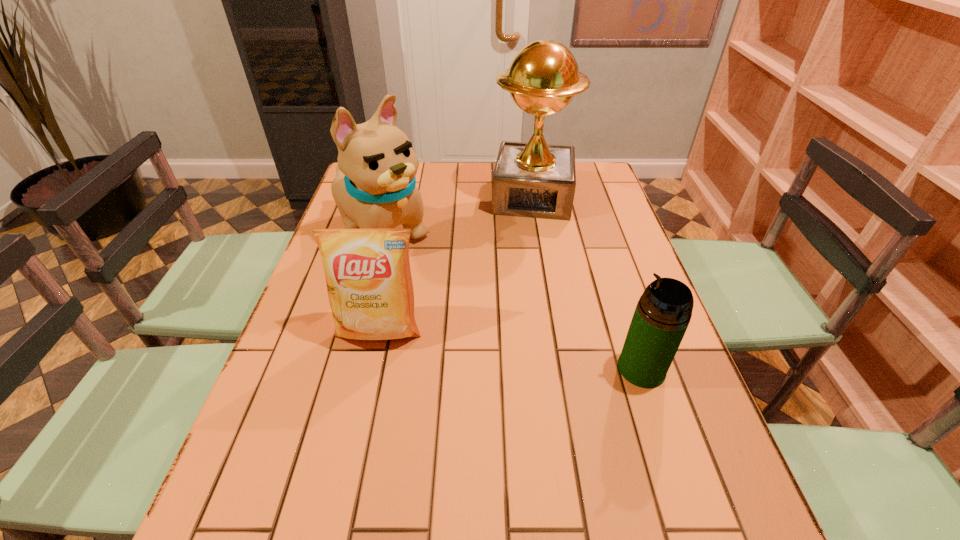
Identify the location of vacant space that satisfies the following two spatial constraints: 1. on the front side of the thermos bottle; 2. from the spout of the second tallest object. Image resolution: width=960 pixels, height=540 pixels. (344, 369).